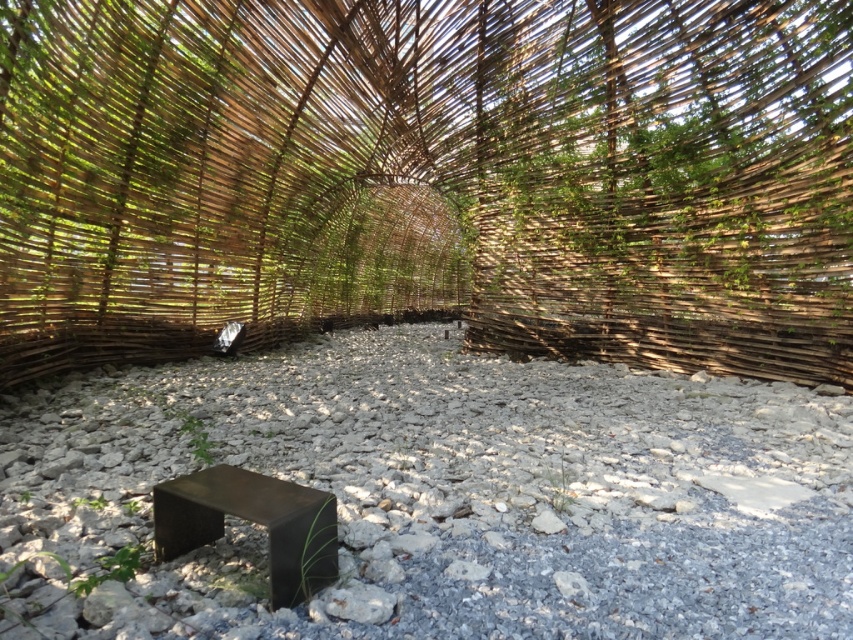
Question: In this image, where is brown woven structure at center located relative to black metal/stainless steel stool at lower left?

Choices:
 (A) below
 (B) above

Answer: (B)

Question: Which point is closer to the camera?

Choices:
 (A) (285, 592)
 (B) (821, 92)

Answer: (A)

Question: Which of the following is the closest to the observer?

Choices:
 (A) brown woven structure at center
 (B) gray gravel at center
 (C) black metal/stainless steel stool at lower left

Answer: (C)

Question: Can you confirm if brown woven structure at center is positioned to the right of black metal/stainless steel stool at lower left?

Choices:
 (A) no
 (B) yes

Answer: (B)

Question: Is brown woven structure at center bigger than gray gravel at center?

Choices:
 (A) no
 (B) yes

Answer: (B)

Question: Which object is closer to the camera taking this photo?

Choices:
 (A) black metal/stainless steel stool at lower left
 (B) brown woven structure at center
 (C) gray gravel at center

Answer: (A)